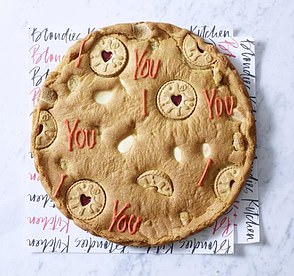
Image resolution: width=294 pixels, height=276 pixels. What are the coordinates of `napkin` in the screenshot? It's located at (50, 38), (238, 51).